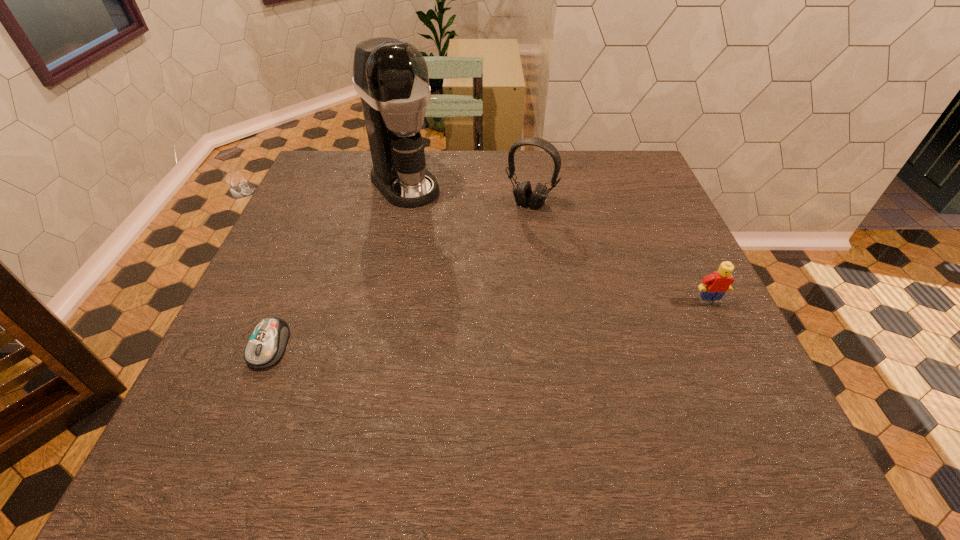
You are a GUI agent. You are given a task and a screenshot of the screen. Output one action in this format:
    pyautogui.click(x=<x>, y=<y>)
    Task: Click on the vacant position in the image that satisfies the following two spatial constraints: 1. on the front side of the coffee maker; 2. on the left side of the third object from left to right
    The width and height of the screenshot is (960, 540).
    Given the screenshot: What is the action you would take?
    pyautogui.click(x=400, y=204)